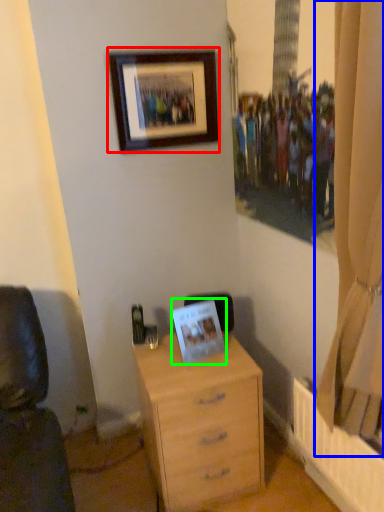
Question: Which is nearer to the picture frame (highlighted by a red box)? curtain (highlighted by a blue box) or picture frame (highlighted by a green box).

Choices:
 (A) curtain
 (B) picture frame

Answer: (B)